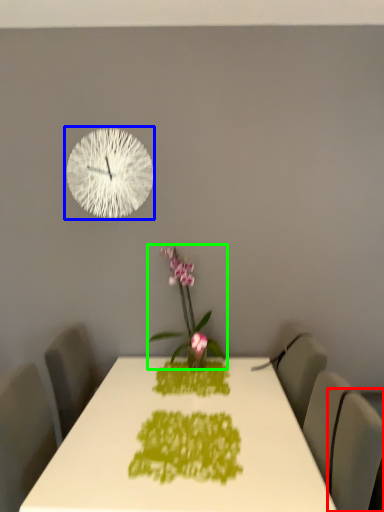
Question: Based on their relative distances, which object is farther from swivel chair (highlighted by a red box)? Choose from wall clock (highlighted by a blue box) and houseplant (highlighted by a green box).

Choices:
 (A) wall clock
 (B) houseplant

Answer: (A)